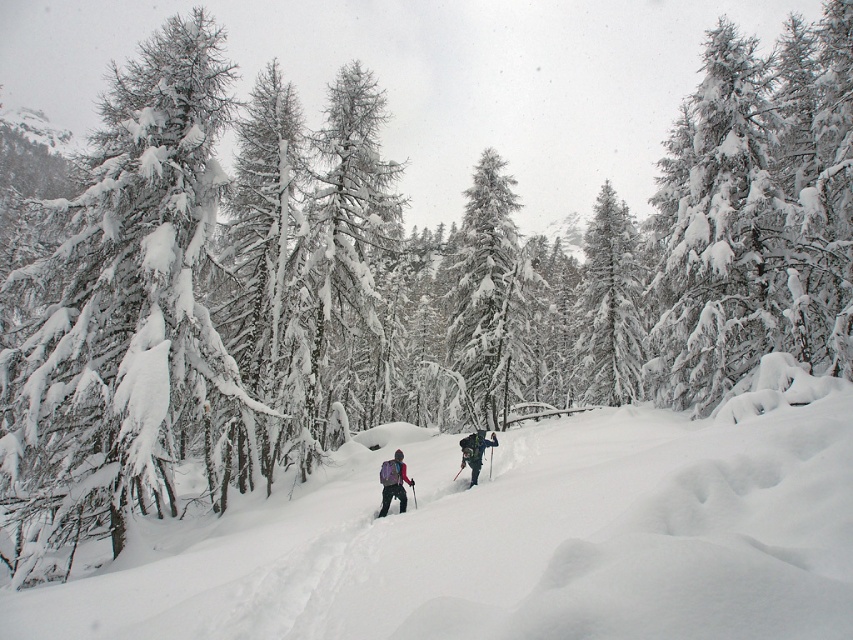
Question: Considering the real-world distances, which object is closest to the snow-covered evergreen tree at center?

Choices:
 (A) matte pink jacket at center
 (B) white fluffy snow at center

Answer: (B)

Question: Which object appears farthest from the camera in this image?

Choices:
 (A) white fluffy snow at center
 (B) matte pink jacket at center
 (C) dark green jacket at center
 (D) snow-covered evergreen tree at center

Answer: (D)

Question: Does snow-covered evergreen tree at center have a lesser width compared to dark green jacket at center?

Choices:
 (A) no
 (B) yes

Answer: (A)

Question: Does green matte tree at center have a lesser width compared to matte purple backpack at center?

Choices:
 (A) yes
 (B) no

Answer: (B)

Question: Which object is the closest to the matte pink jacket at center?

Choices:
 (A) green matte tree at center
 (B) snow-covered evergreen tree at center
 (C) dark green jacket at center

Answer: (C)

Question: Does white fluffy snow at center appear on the left side of dark green jacket at center?

Choices:
 (A) yes
 (B) no

Answer: (A)